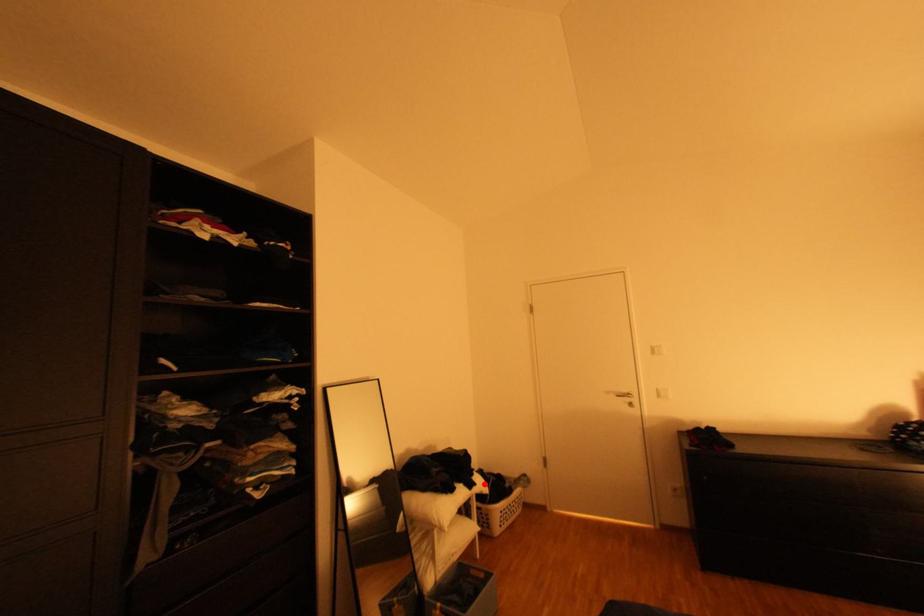
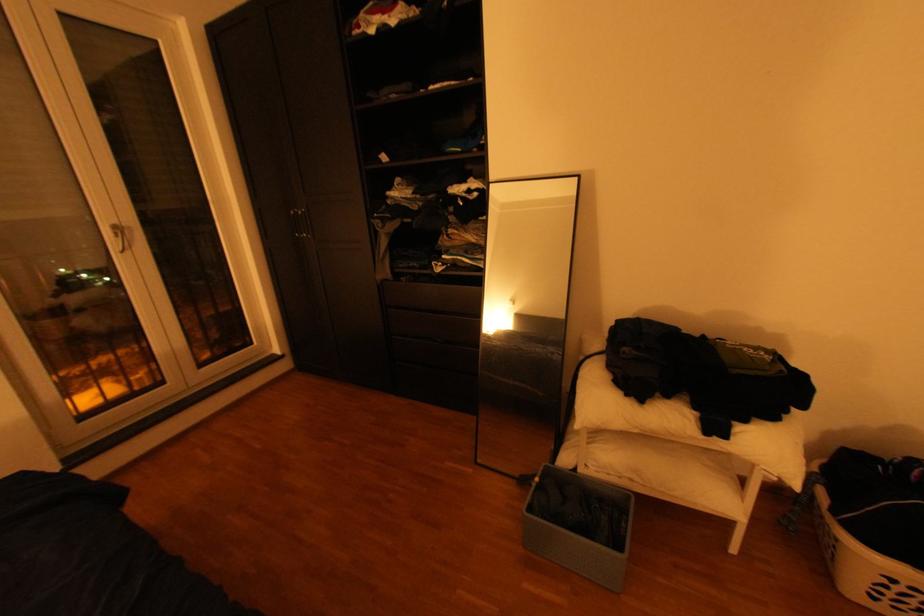
Question: I am providing you with two images of the same scene from different viewpoints. A red point is shown in image1. For the corresponding object point in image2, is it positioned nearer or farther from the camera?

Choices:
 (A) Nearer
 (B) Farther

Answer: (A)